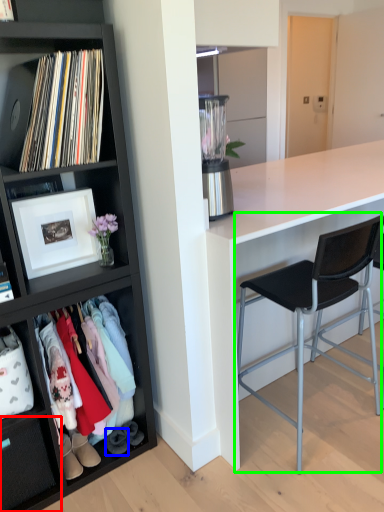
Question: Which object is the closest to the drawer (highlighted by a red box)? Choose among these: shoe (highlighted by a blue box) or chair (highlighted by a green box).

Choices:
 (A) shoe
 (B) chair

Answer: (A)